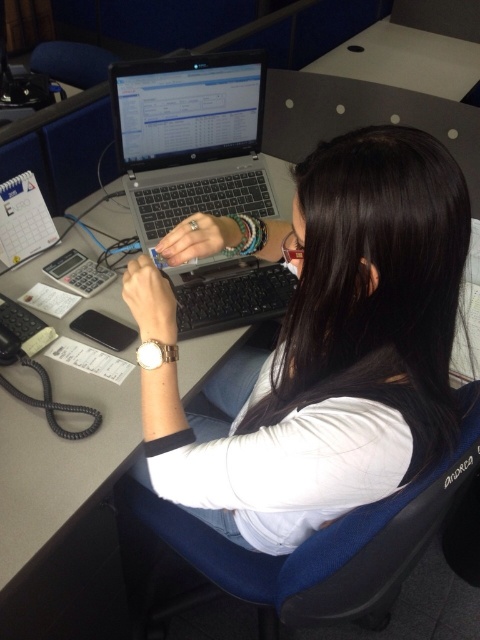
Question: In this image, where is blue fabric chair at center located relative to silver/black laptop at center?

Choices:
 (A) above
 (B) below

Answer: (B)

Question: Which object appears closest to the camera in this image?

Choices:
 (A) blue fabric chair at center
 (B) silver/black laptop at center
 (C) white plastic table at upper center

Answer: (A)

Question: Which object is farther from the camera taking this photo?

Choices:
 (A) white matte laptop at center
 (B) blue fabric chair at center
 (C) silver/black laptop at center
 (D) white plastic table at upper center

Answer: (D)

Question: Which point is farther from the camera taking this photo?

Choices:
 (A) (127, 77)
 (B) (394, 552)
 (C) (437, 308)

Answer: (A)

Question: Does white matte laptop at center have a larger size compared to white plastic table at upper center?

Choices:
 (A) no
 (B) yes

Answer: (A)

Question: Does white matte laptop at center appear on the left side of silver/black laptop at center?

Choices:
 (A) yes
 (B) no

Answer: (B)